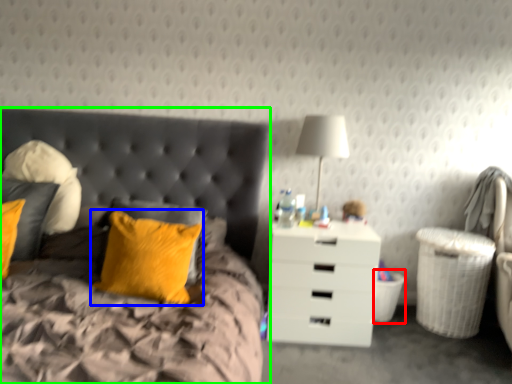
Question: Based on their relative distances, which object is nearer to laundry basket (highlighted by a red box)? Choose from pillow (highlighted by a blue box) and bed (highlighted by a green box).

Choices:
 (A) pillow
 (B) bed

Answer: (A)